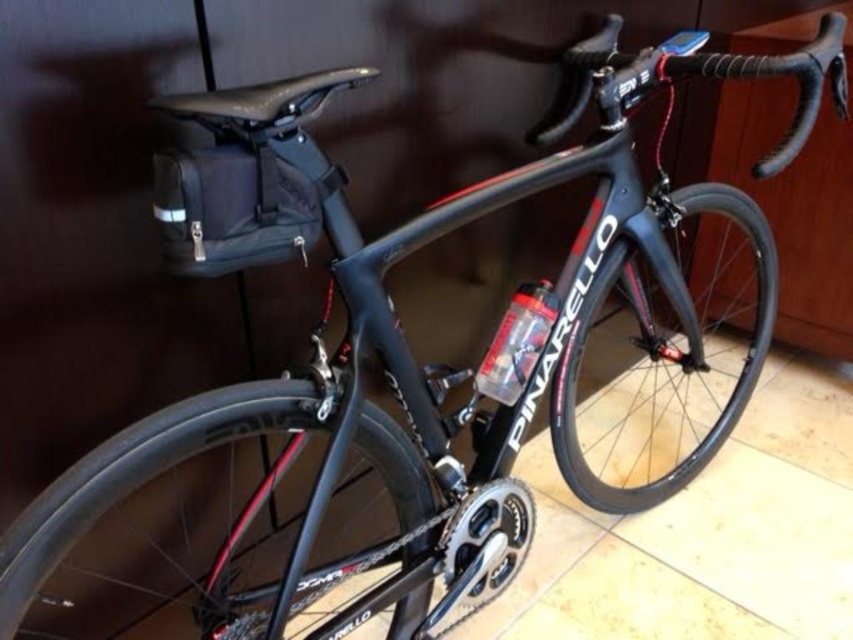
Question: In this image, where is carbon fiber wheel at center located relative to shiny black rim at center?

Choices:
 (A) below
 (B) above

Answer: (B)

Question: Among these objects, which one is nearest to the camera?

Choices:
 (A) shiny black rim at center
 (B) carbon fiber wheel at center

Answer: (A)

Question: Which object appears closest to the camera in this image?

Choices:
 (A) shiny black rim at center
 (B) carbon fiber wheel at center

Answer: (A)

Question: Is carbon fiber wheel at center to the left of shiny black rim at center from the viewer's perspective?

Choices:
 (A) yes
 (B) no

Answer: (B)

Question: Is carbon fiber wheel at center below shiny black rim at center?

Choices:
 (A) no
 (B) yes

Answer: (A)

Question: Which point is closer to the camera?

Choices:
 (A) (735, 371)
 (B) (195, 445)

Answer: (B)